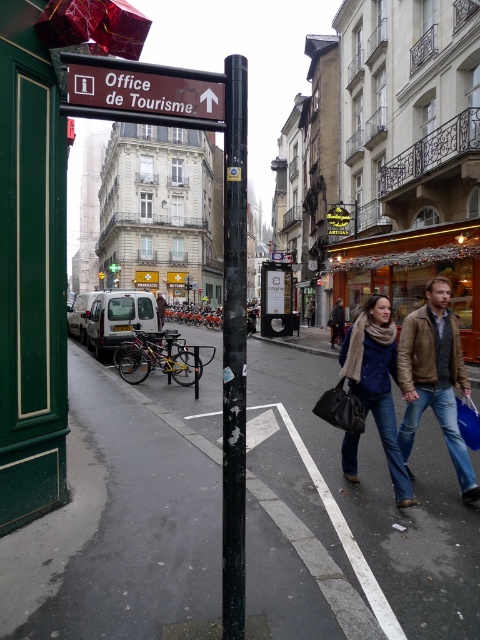
Question: Is black asphalt pavement at lower center thinner than brown wooden sign at upper center?

Choices:
 (A) no
 (B) yes

Answer: (A)

Question: Which object appears farthest from the camera in this image?

Choices:
 (A) blue denim jeans at lower right
 (B) brown wooden sign at upper center
 (C) black matte pole at center
 (D) black asphalt pavement at lower center

Answer: (A)

Question: Which object appears closest to the camera in this image?

Choices:
 (A) brown wooden sign at upper center
 (B) black asphalt pavement at lower center

Answer: (A)

Question: Does black asphalt pavement at lower center have a greater width compared to blue denim jeans at lower right?

Choices:
 (A) no
 (B) yes

Answer: (B)

Question: Which point is farther to the camera?

Choices:
 (A) coord(375,305)
 (B) coord(226,225)

Answer: (A)

Question: Is black asphalt pavement at lower center positioned behind brown wooden sign at upper center?

Choices:
 (A) yes
 (B) no

Answer: (A)